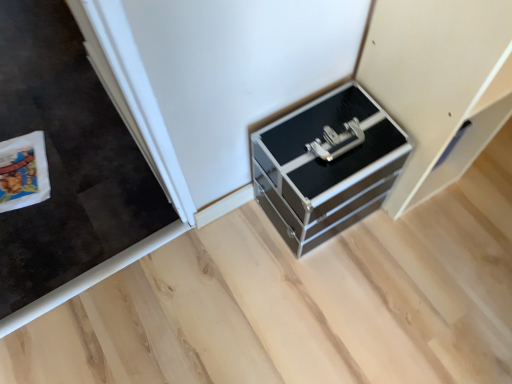
At what (x,y) coordinates should I click in order to perform the action: click on free space in front of metallic silver drawer at lower right. Please return your answer as a coordinate pair (x, y). The image size is (512, 384). Looking at the image, I should click on (422, 251).